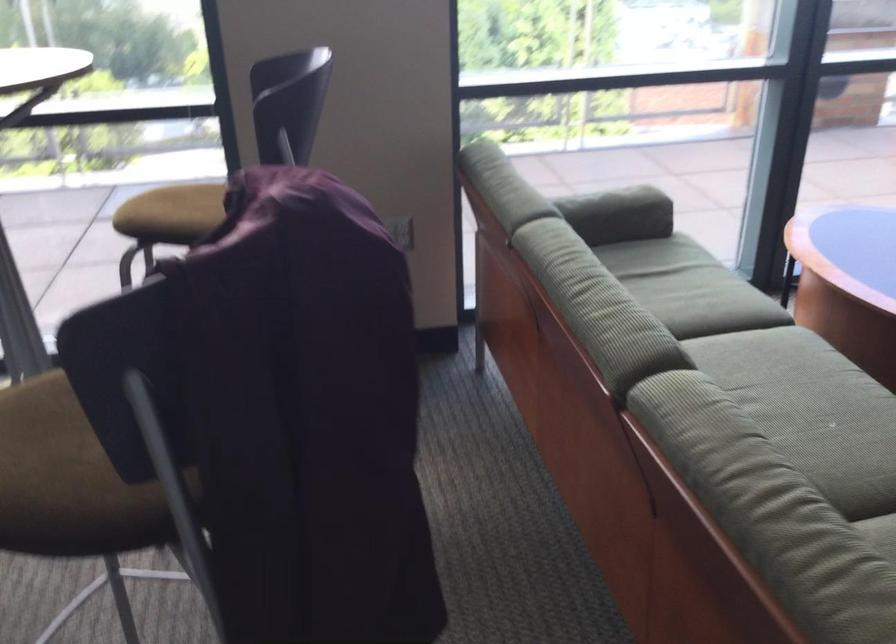
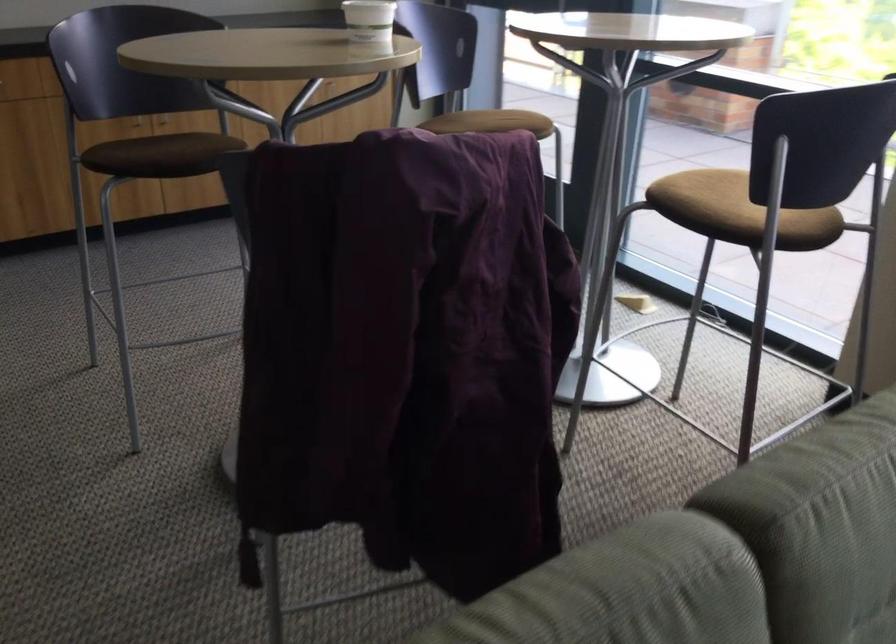
The point at [727,399] is marked in the first image. Where is the corresponding point in the second image?

(668, 585)